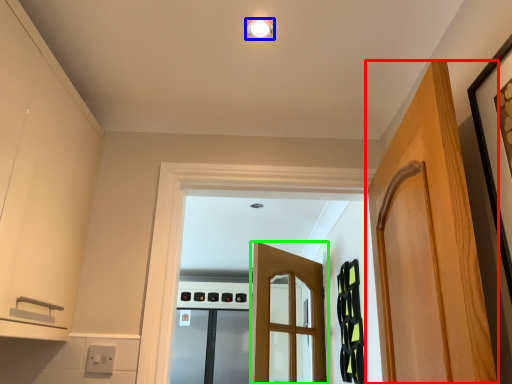
Question: Which is farther away from door (highlighted by a red box)? light fixture (highlighted by a blue box) or door (highlighted by a green box)?

Choices:
 (A) light fixture
 (B) door

Answer: (B)